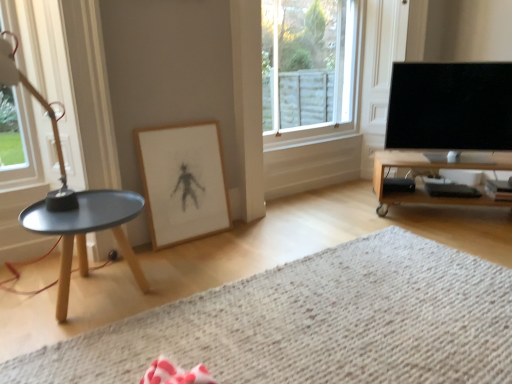
Where is `free spot below matte black tray at left (from a real-world perspective)`? free spot below matte black tray at left (from a real-world perspective) is located at coordinates (99, 304).